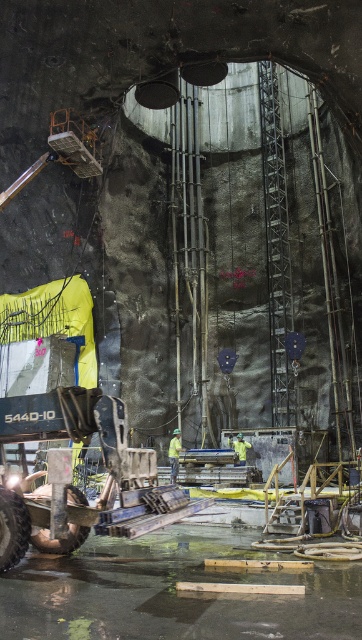
Between yellow fabric at center and yellow reflective safety vest at center, which one is positioned lower?

Positioned lower is yellow fabric at center.

Who is higher up, yellow fabric at center or yellow reflective safety vest at center?

yellow reflective safety vest at center

Describe the element at coordinates (174, 454) in the screenshot. This screenshot has width=362, height=640. I see `yellow fabric at center` at that location.

The width and height of the screenshot is (362, 640). Identify the location of yellow fabric at center. (174, 454).

Where is `metallic gray machinery at lower left`? The height and width of the screenshot is (640, 362). metallic gray machinery at lower left is located at coordinates (70, 474).

Which is more to the left, metallic gray machinery at lower left or yellow fabric at center?

metallic gray machinery at lower left

Does point (103, 403) come behind point (178, 435)?

No.

The height and width of the screenshot is (640, 362). In order to click on metallic gray machinery at lower left in this screenshot , I will do `click(70, 474)`.

Does metallic gray machinery at lower left appear over yellow reflective safety vest at center?

Yes, metallic gray machinery at lower left is above yellow reflective safety vest at center.

Find the location of `metallic gray machinery at lower left`. metallic gray machinery at lower left is located at coordinates (70, 474).